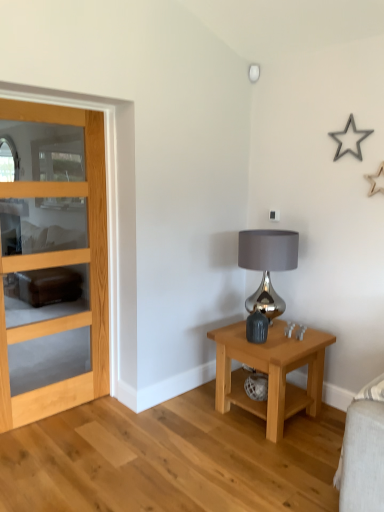
Identify the location of free point in front of light wood/finish nightstand at lower right. (265, 462).